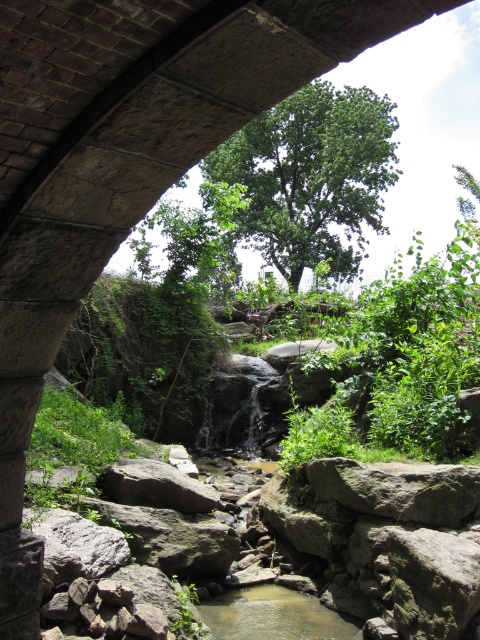
You are standing under the stone bridge and want to take a photo of both point (368,145) and point (237,595). Which point should you focus on first to ensure both are in focus?

You should focus on point (368,145) first because it is closer to the camera than point (237,595). This ensures the depth of field will cover both points.

You are standing under the stone bridge and want to take a photo of the green leafy tree at upper center. Your camera has a zoom lens that can focus up to 2 meters away. Will you need to zoom in to capture the tree in the photo?

The green leafy tree at upper center is 2.25 meters away from the viewer. Since your camera can focus up to 2 meters, you will need to zoom in to capture the tree as it is slightly beyond the camera range.

You are a bird looking for a place to perch. You see the green leafy tree at upper center and the clear water at stream center. Which location offers a higher spot to sit?

The green leafy tree at upper center is taller than the clear water at stream center, so it offers a higher spot to perch.